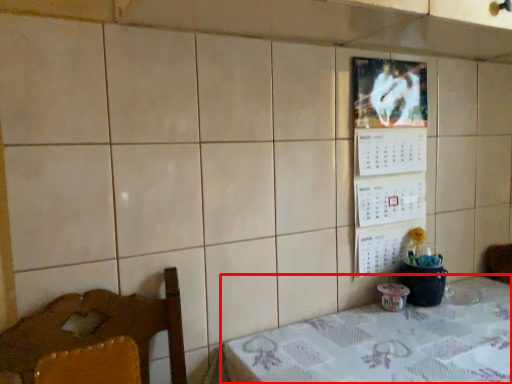
Question: From the image's perspective, what is the correct spatial positioning of table (annotated by the red box) in reference to bulletin board?

Choices:
 (A) above
 (B) below

Answer: (B)